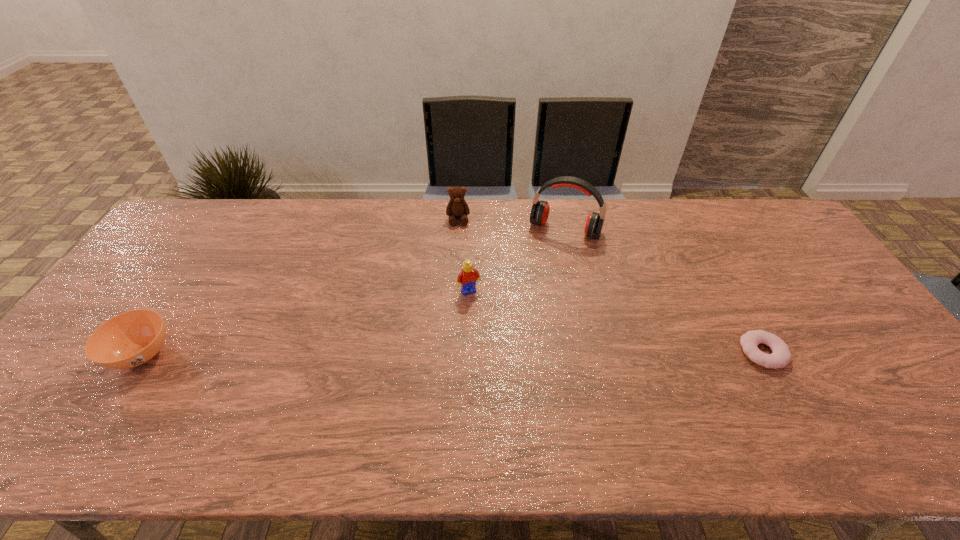
Identify the location of earphone at the far edge. This screenshot has height=540, width=960. (539, 214).

I want to click on object present at the near edge, so click(x=130, y=339).

Locate an element on the screen. The height and width of the screenshot is (540, 960). object that is at the left edge is located at coordinates (130, 339).

Locate an element on the screen. This screenshot has height=540, width=960. object located in the near left corner section of the desktop is located at coordinates (130, 339).

In the image, there is a desktop. At what (x,y) coordinates should I click in order to perform the action: click on vacant space at the far edge. Please return your answer as a coordinate pair (x, y). This screenshot has width=960, height=540. Looking at the image, I should click on (311, 213).

The height and width of the screenshot is (540, 960). I want to click on blank area at the near edge, so click(655, 383).

Locate an element on the screen. This screenshot has width=960, height=540. vacant space at the left edge is located at coordinates (188, 259).

This screenshot has height=540, width=960. Identify the location of vacant region at the right edge of the desktop. (872, 370).

Find the location of a particular element. free space at the far left corner of the desktop is located at coordinates (218, 221).

Locate an element on the screen. This screenshot has height=540, width=960. vacant space that is in between the soup bowl and the shortest object is located at coordinates 452,353.